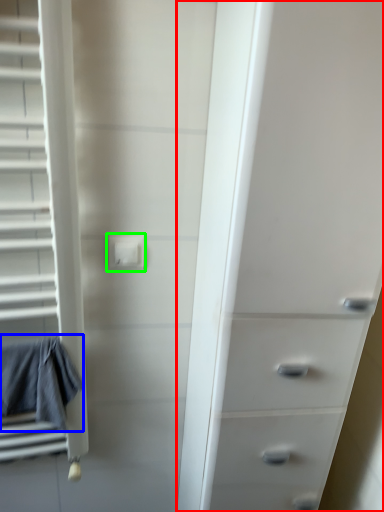
Question: Which object is the farthest from chest of drawers (highlighted by a red box)? Choose among these: bath towel (highlighted by a blue box) or electric outlet (highlighted by a green box).

Choices:
 (A) bath towel
 (B) electric outlet

Answer: (A)